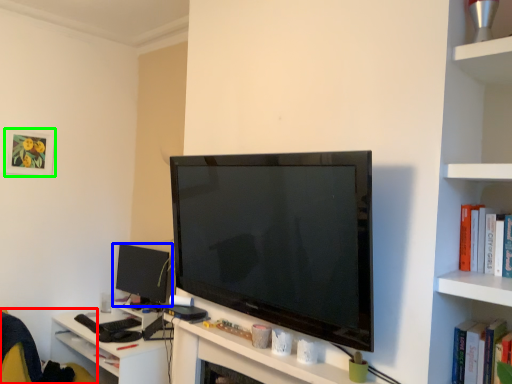
Question: Which object is the farthest from swivel chair (highlighted by a red box)? Choose among these: computer monitor (highlighted by a blue box) or picture frame (highlighted by a green box).

Choices:
 (A) computer monitor
 (B) picture frame

Answer: (B)